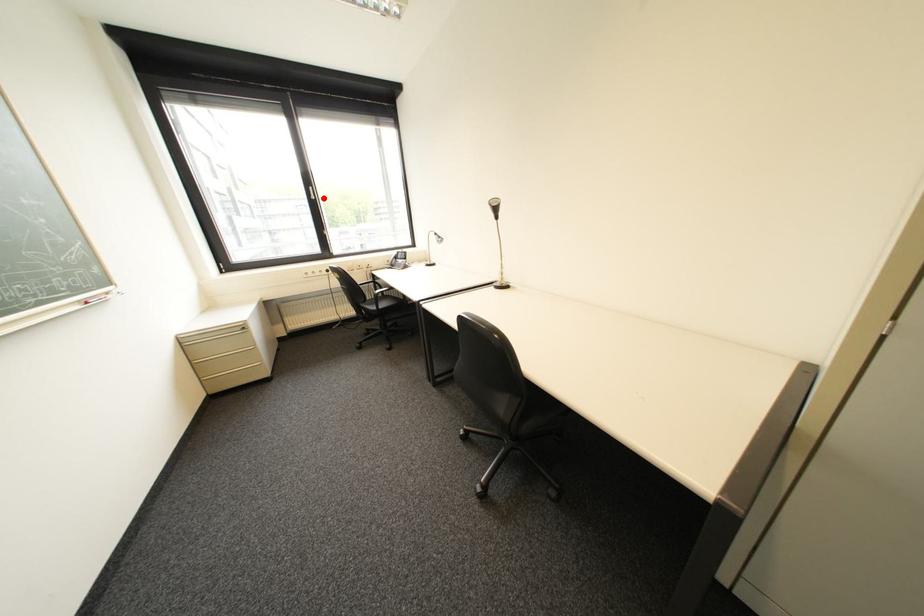
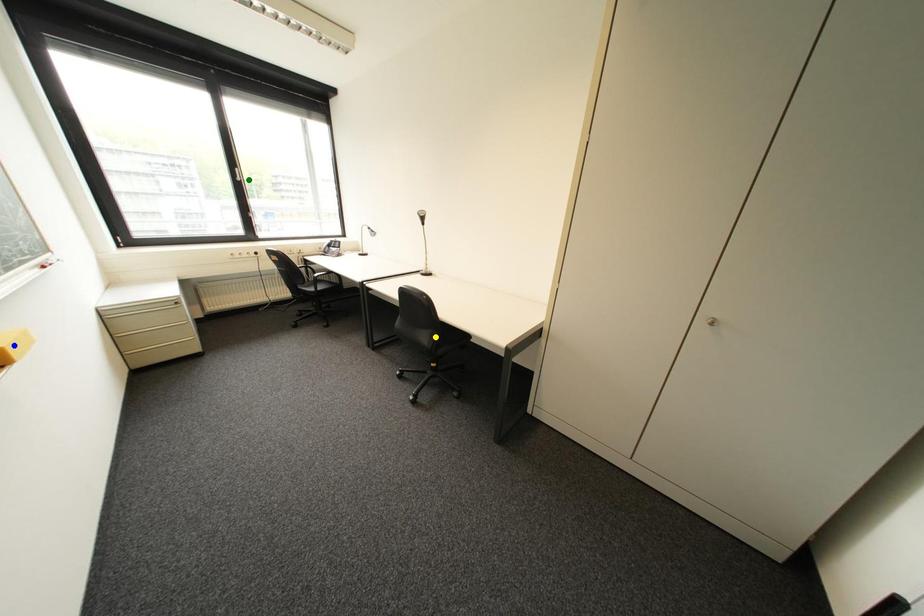
Question: I am providing you with two images of the same scene from different viewpoints. A red point is marked on the first image. You are given multiple points on the second image. Can you choose the point in image 2 that corresponds to the point in image 1?

Choices:
 (A) yellow point
 (B) blue point
 (C) green point

Answer: (C)